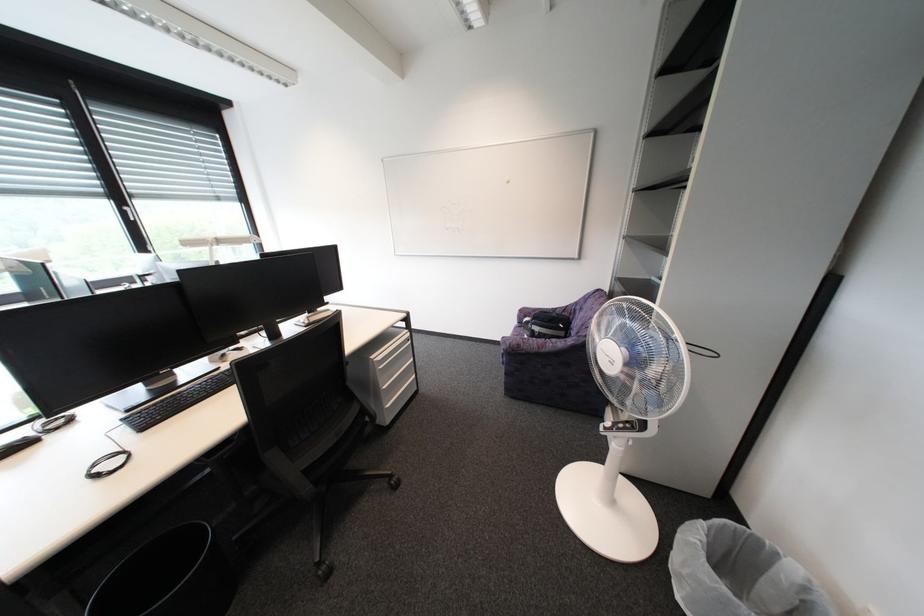
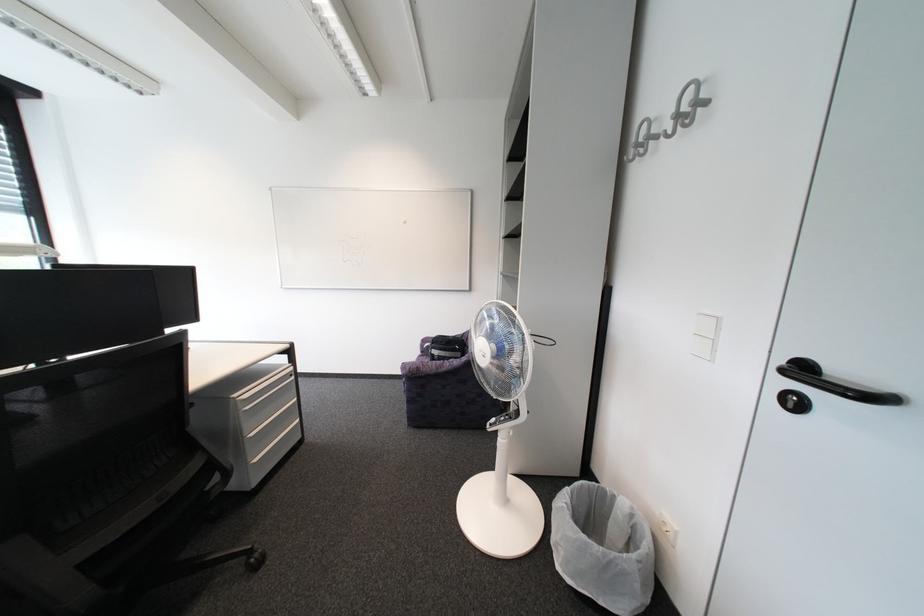
Question: The first image is from the beginning of the video and the second image is from the end. How did the camera likely rotate when shooting the video?

Choices:
 (A) Left
 (B) Right
 (C) Up
 (D) Down

Answer: (B)